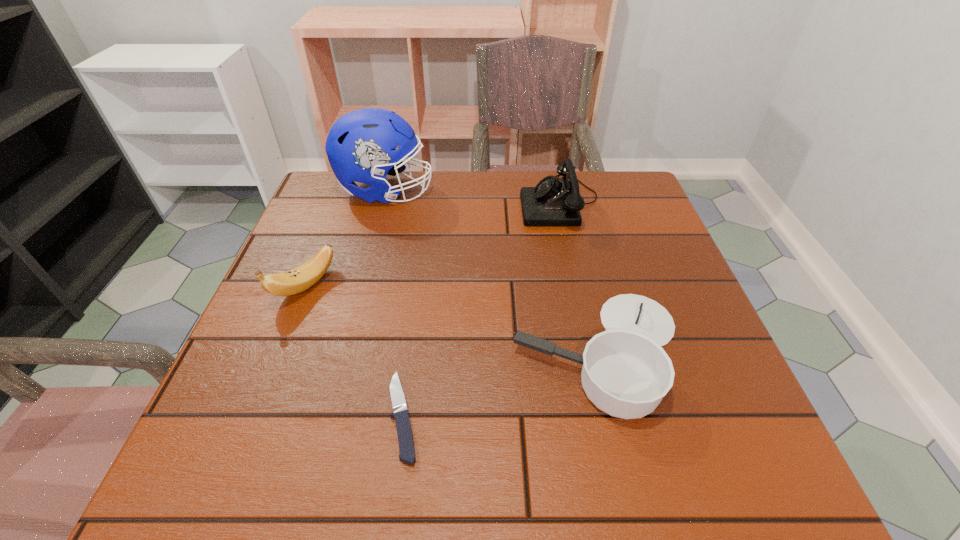
Locate an element on the screen. Image resolution: width=960 pixels, height=540 pixels. the tallest object is located at coordinates (361, 145).

Find the location of `telephone`. telephone is located at coordinates (554, 201).

Where is `banana`? The width and height of the screenshot is (960, 540). banana is located at coordinates (299, 279).

Where is `the second shortest object`? the second shortest object is located at coordinates (626, 373).

This screenshot has width=960, height=540. Identify the location of the shortest object. (405, 438).

The image size is (960, 540). Identify the location of free space located on the face guard of the tallest object. (557, 191).

Locate an element on the screen. vacant space located 0.360m on the front face of the telephone is located at coordinates (386, 202).

Where is `vacant space situated 0.090m on the front face of the telephone`? This screenshot has height=540, width=960. vacant space situated 0.090m on the front face of the telephone is located at coordinates (487, 202).

Where is `free space located on the front face of the telephone`? free space located on the front face of the telephone is located at coordinates (408, 202).

You are a GUI agent. You are given a task and a screenshot of the screen. Output one action in this format:
    pyautogui.click(x=<x>, y=<y>)
    Task: Click on the vacant space located 0.350m on the right of the banana
    This screenshot has width=960, height=540.
    Given the screenshot: What is the action you would take?
    pyautogui.click(x=493, y=286)